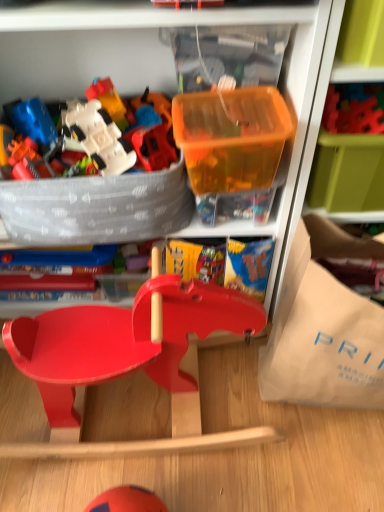
Identify the location of vacant area in front of beige paper bag at right. (322, 468).